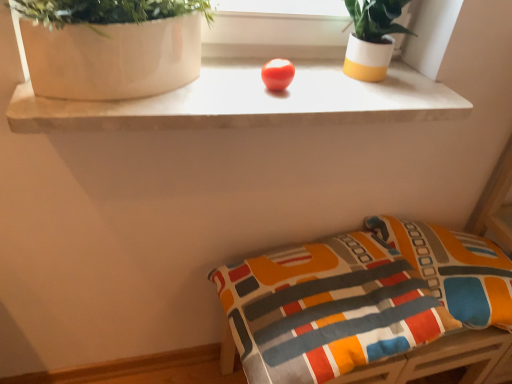
Question: Considering the positions of textured fabric pillow at lower right and white/yellow ceramic pot at upper right in the image, is textured fabric pillow at lower right bigger or smaller than white/yellow ceramic pot at upper right?

Choices:
 (A) big
 (B) small

Answer: (A)

Question: Is textured fabric pillow at lower right spatially inside white/yellow ceramic pot at upper right, or outside of it?

Choices:
 (A) outside
 (B) inside

Answer: (A)

Question: Estimate the real-world distances between objects in this image. Which object is closer to the matte white shelf at center?

Choices:
 (A) white/yellow ceramic pot at upper right
 (B) textured fabric cushion at lower right
 (C) textured fabric pillow at lower right
 (D) white glossy vase at upper left

Answer: (D)

Question: Which object is positioned farthest from the white glossy vase at upper left?

Choices:
 (A) white/yellow ceramic pot at upper right
 (B) matte white shelf at center
 (C) textured fabric pillow at lower right
 (D) textured fabric cushion at lower right

Answer: (C)